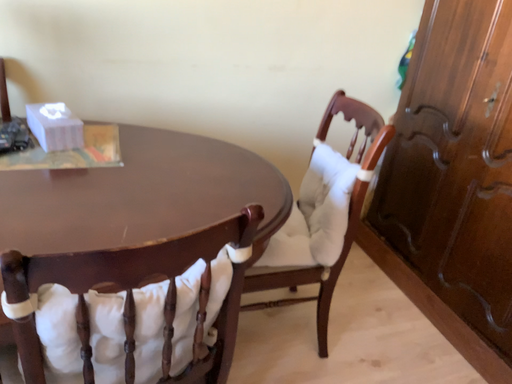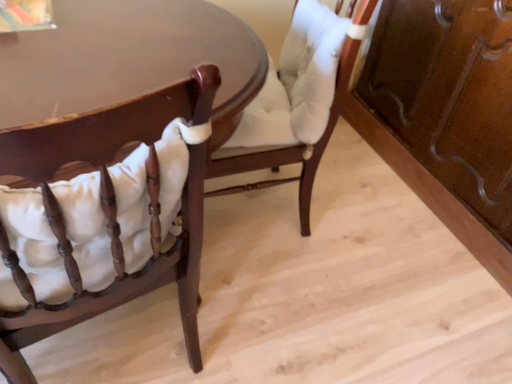
Question: Which way did the camera rotate in the video?

Choices:
 (A) rotated downward
 (B) rotated upward

Answer: (A)